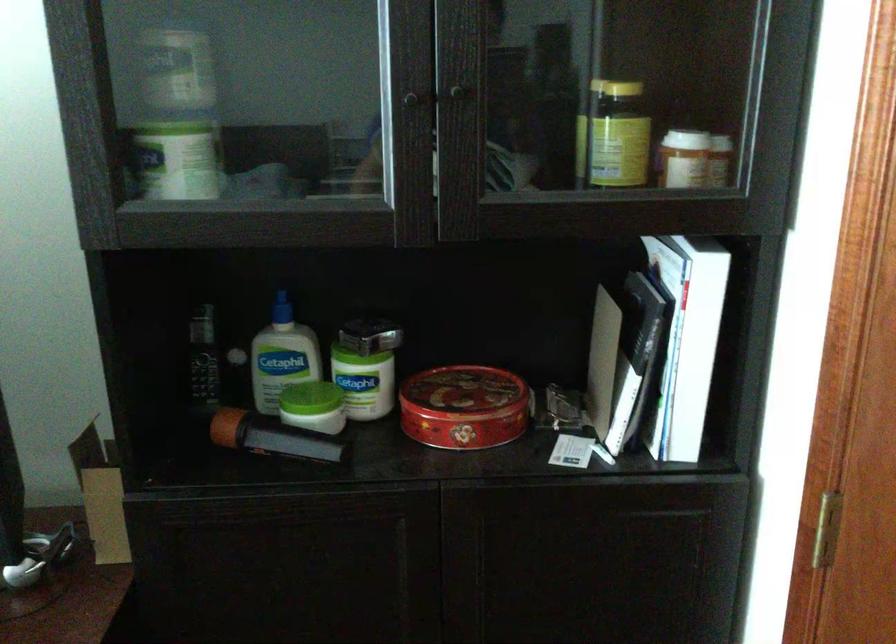
Locate an element on the screen. This screenshot has height=644, width=896. white bottle cap is located at coordinates (686, 135).